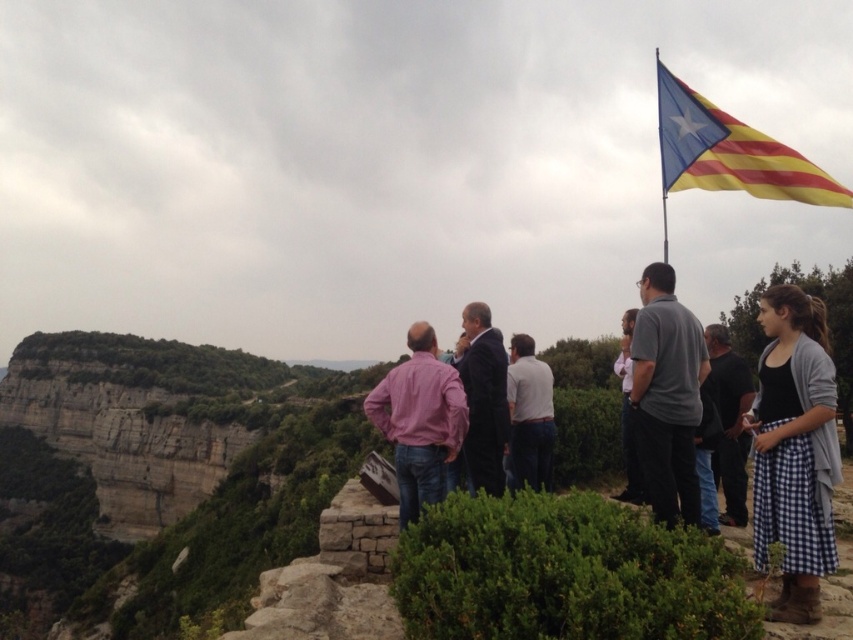
You are standing at the edge of the rocky outcrop and want to take a photo of both the point at coordinates (523,355) and the point at coordinates (630,442). Which point is closer to you so that you can focus on it first?

Point at coordinates (523,355) is closer to you than point at coordinates (630,442), so you should focus on it first.

You are a hiker preparing to cross a narrow rocky path. You have two shirts in your backpack to choose from for the hike. The white cotton shirt at center and the gray fabric shirt at right. Based on the weather conditions described in the scene, which shirt would be more appropriate to wear?

The gray fabric shirt at right is thicker, providing better insulation against the cooler weather indicated by the overcast sky and the group wearing jackets in the scene.